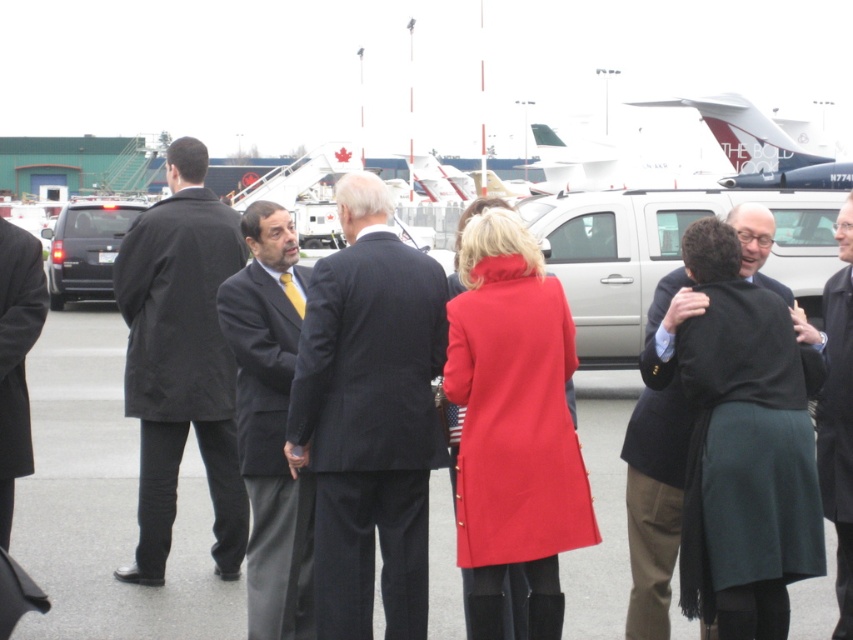
Is point (378, 365) positioned before point (467, 179)?

Yes, point (378, 365) is closer to viewer.

Is point (398, 346) less distant than point (479, 184)?

Yes, point (398, 346) is closer to viewer.

Locate an element on the screen. Image resolution: width=853 pixels, height=640 pixels. dark suit at center is located at coordinates (368, 417).

Is black coat at left shorter than matte black suv at left?

In fact, black coat at left may be taller than matte black suv at left.

Who is more forward, (202, 448) or (61, 216)?

Point (202, 448) is in front.

Is point (196, 160) closer to viewer compared to point (74, 224)?

Yes, point (196, 160) is closer to viewer.

The width and height of the screenshot is (853, 640). Identify the location of black coat at left. (181, 360).

From the picture: Which of these two, black coat at center or white matte airplane at upper center, stands shorter?

black coat at center is shorter.

The width and height of the screenshot is (853, 640). What are the coordinates of `black coat at center` in the screenshot? It's located at (838, 417).

You are a GUI agent. You are given a task and a screenshot of the screen. Output one action in this format:
    pyautogui.click(x=<x>, y=<y>)
    Task: Click on the black coat at center
    This screenshot has height=640, width=853.
    Given the screenshot: What is the action you would take?
    pyautogui.click(x=838, y=417)